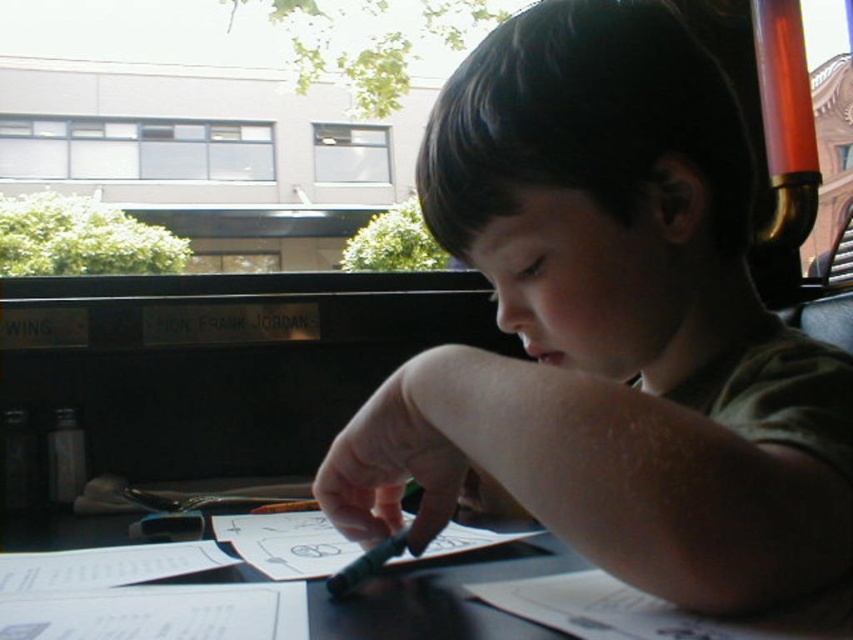
You are a teacher observing a child at a table. The child has a matte green crayon at center and a black paper at center. Which object is on top of the other?

The matte green crayon at center is positioned over black paper at center, so it is on top.

You are a teacher observing a child at a table with a matte green crayon at center and a black paper at center. Which object is bigger?

The matte green crayon at center is larger in size than the black paper at center.